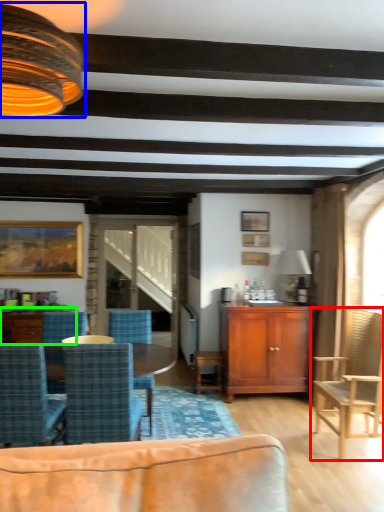
Question: Estimate the real-world distances between objects in this image. Which object is farther from chair (highlighted by a red box), lamp (highlighted by a blue box) or coffee table (highlighted by a green box)?

Choices:
 (A) lamp
 (B) coffee table

Answer: (A)